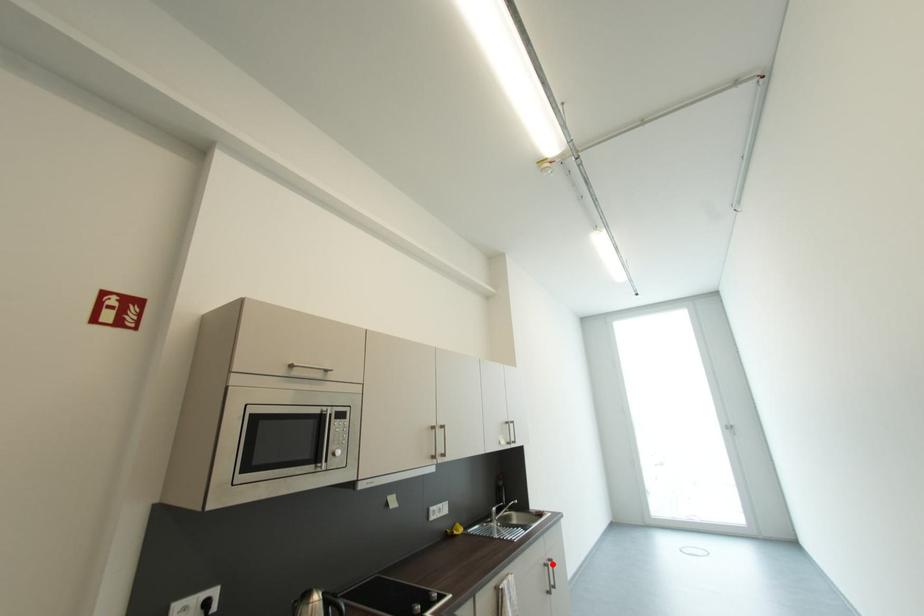
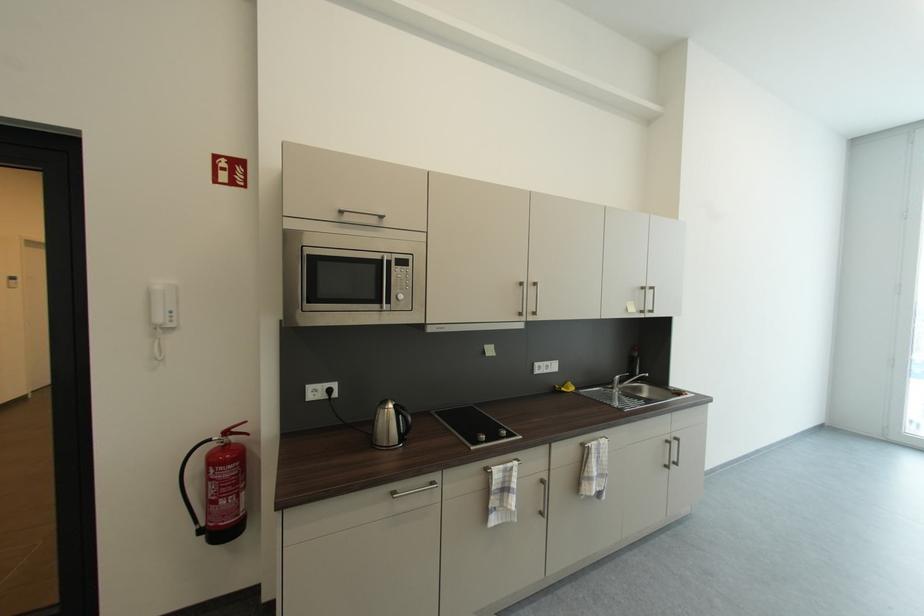
Question: I am providing you with two images of the same scene from different viewpoints. Given a red point in image1, look at the same physical point in image2. Is it:

Choices:
 (A) Closer to the viewpoint
 (B) Farther from the viewpoint

Answer: (A)